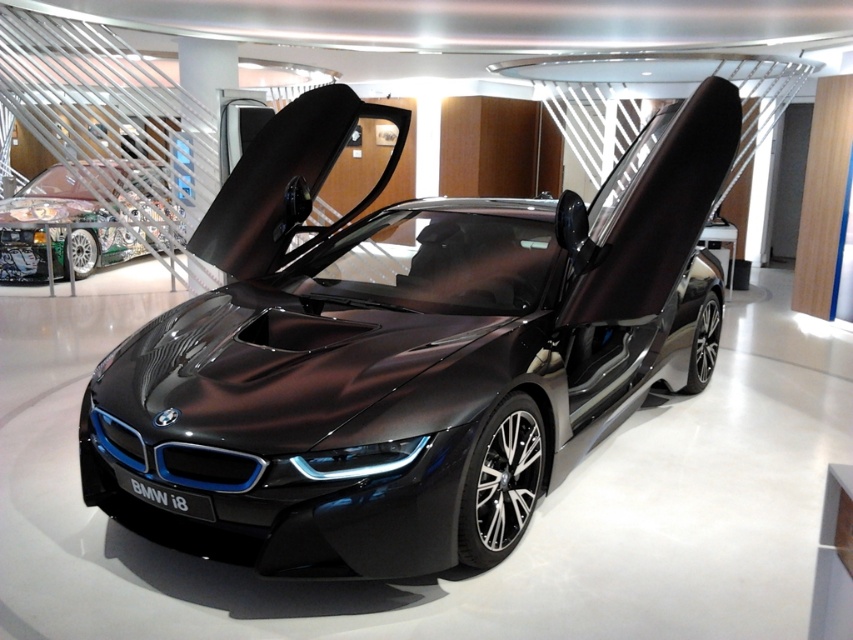
Question: Is glossy metallic car at center below shiny metallic race car at left?

Choices:
 (A) yes
 (B) no

Answer: (A)

Question: Does glossy metallic car at center appear over shiny metallic race car at left?

Choices:
 (A) no
 (B) yes

Answer: (A)

Question: Among these objects, which one is nearest to the camera?

Choices:
 (A) shiny metallic race car at left
 (B) glossy metallic car at center

Answer: (B)

Question: Is glossy metallic car at center above shiny metallic race car at left?

Choices:
 (A) no
 (B) yes

Answer: (A)

Question: Which object appears closest to the camera in this image?

Choices:
 (A) glossy metallic car at center
 (B) shiny metallic race car at left

Answer: (A)